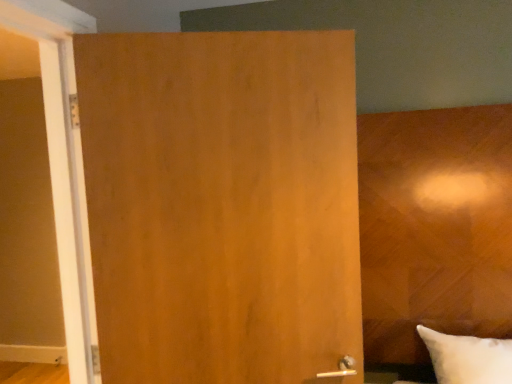
What do you see at coordinates (222, 204) in the screenshot? This screenshot has height=384, width=512. I see `wooden door at center` at bounding box center [222, 204].

Find the location of `wooden door at center`. wooden door at center is located at coordinates (222, 204).

Identify the location of wooden door at center. The width and height of the screenshot is (512, 384). (222, 204).